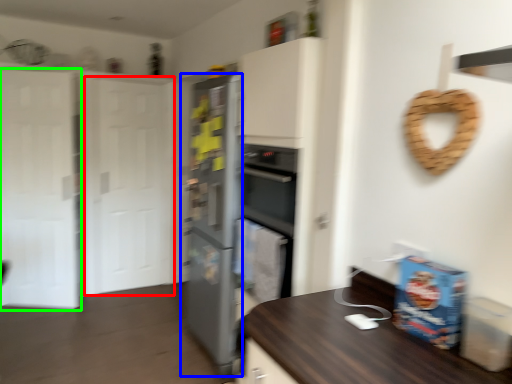
Question: Which object is the farthest from glass door (highlighted by a red box)? Choose among these: refrigerator (highlighted by a blue box) or glass door (highlighted by a green box).

Choices:
 (A) refrigerator
 (B) glass door

Answer: (A)